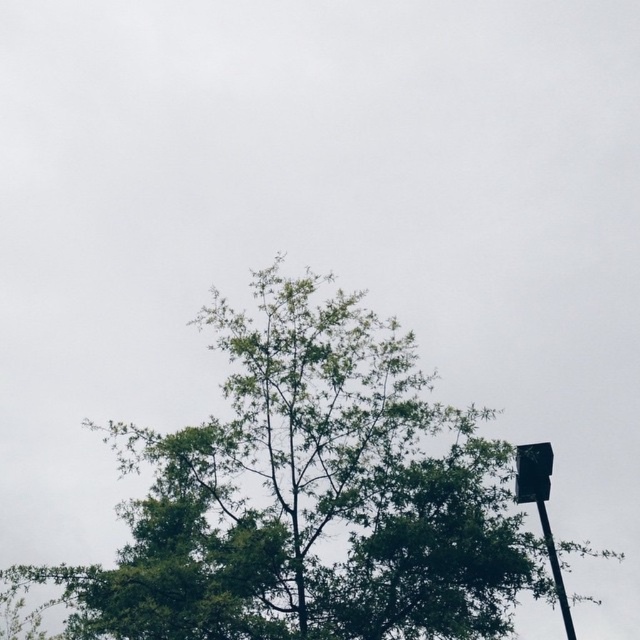
You are a bird looking for a place to perch. You see the green leafy tree at upper center and the metallic pole at upper right. Which one is higher up in the image?

The green leafy tree at upper center is located above the metallic pole at upper right, so it is higher up in the image.